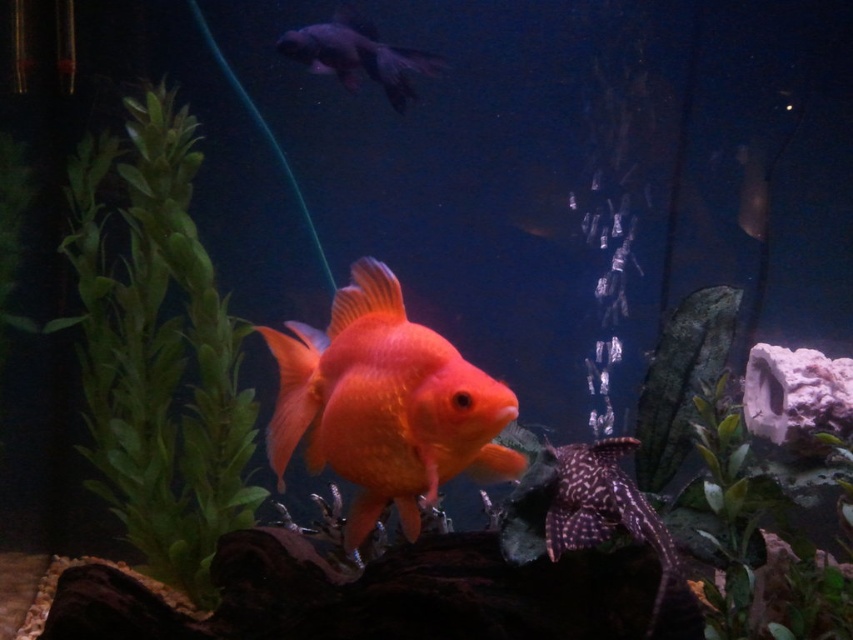
Question: Does green matte plant at lower right appear on the right side of shiny black fish at upper center?

Choices:
 (A) yes
 (B) no

Answer: (A)

Question: Which of the following is the farthest from the observer?

Choices:
 (A) (114, 492)
 (B) (732, 557)
 (C) (561, 506)

Answer: (A)

Question: Does green matte plant at lower right have a lesser width compared to shiny black and white spotted fish at lower center?

Choices:
 (A) no
 (B) yes

Answer: (A)

Question: Considering the real-world distances, which object is farthest from the shiny orange fish at center?

Choices:
 (A) shiny black and white spotted fish at lower center
 (B) green leafy plant at left
 (C) green matte plant at lower right

Answer: (B)

Question: Does shiny orange fish at center appear over green matte plant at lower right?

Choices:
 (A) yes
 (B) no

Answer: (A)

Question: Considering the real-world distances, which object is farthest from the green matte plant at lower right?

Choices:
 (A) shiny orange fish at center
 (B) shiny black and white spotted fish at lower center

Answer: (A)